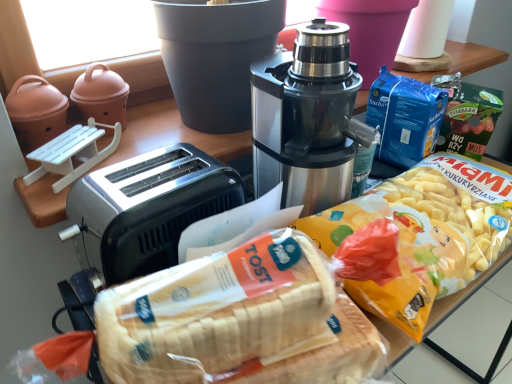
Question: Is matte ceramic pot at upper left outside of satin black coffee maker at center?

Choices:
 (A) yes
 (B) no

Answer: (A)

Question: From the image's perspective, is matte ceramic pot at upper left over satin black coffee maker at center?

Choices:
 (A) no
 (B) yes

Answer: (B)

Question: Is matte ceramic pot at upper left wider than satin black coffee maker at center?

Choices:
 (A) yes
 (B) no

Answer: (B)

Question: Is matte ceramic pot at upper left positioned far away from satin black coffee maker at center?

Choices:
 (A) no
 (B) yes

Answer: (A)

Question: Considering the relative sizes of matte ceramic pot at upper left and satin black coffee maker at center in the image provided, is matte ceramic pot at upper left taller than satin black coffee maker at center?

Choices:
 (A) no
 (B) yes

Answer: (A)

Question: From the image's perspective, is matte ceramic pot at upper left positioned above or below white bread at center?

Choices:
 (A) above
 (B) below

Answer: (A)

Question: From a real-world perspective, is matte ceramic pot at upper left positioned above or below white bread at center?

Choices:
 (A) below
 (B) above

Answer: (B)

Question: Is matte ceramic pot at upper left wider or thinner than white bread at center?

Choices:
 (A) wide
 (B) thin

Answer: (B)

Question: Considering their positions, is matte ceramic pot at upper left located in front of or behind white bread at center?

Choices:
 (A) front
 (B) behind

Answer: (B)

Question: Which is correct: satin black coffee maker at center is inside satin silver toaster at left, or outside of it?

Choices:
 (A) inside
 (B) outside

Answer: (B)

Question: In terms of height, does satin black coffee maker at center look taller or shorter compared to satin silver toaster at left?

Choices:
 (A) short
 (B) tall

Answer: (B)

Question: In terms of width, does satin black coffee maker at center look wider or thinner when compared to satin silver toaster at left?

Choices:
 (A) thin
 (B) wide

Answer: (B)

Question: Is point (335, 76) positioned closer to the camera than point (121, 206)?

Choices:
 (A) farther
 (B) closer

Answer: (A)

Question: Looking at their shapes, would you say matte ceramic pot at upper left is wider or thinner than satin black coffee maker at center?

Choices:
 (A) thin
 (B) wide

Answer: (A)

Question: Does point (114, 102) appear closer or farther from the camera than point (321, 44)?

Choices:
 (A) farther
 (B) closer

Answer: (A)